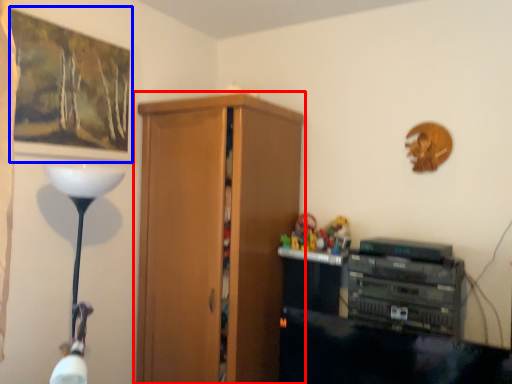
Question: Among these objects, which one is farthest to the camera, cupboard (highlighted by a red box) or picture frame (highlighted by a blue box)?

Choices:
 (A) cupboard
 (B) picture frame

Answer: (A)